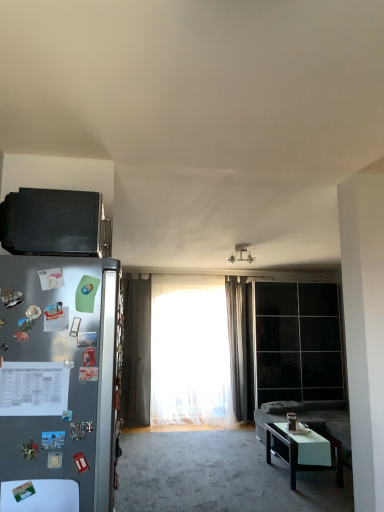
What do you see at coordinates (190, 351) in the screenshot? I see `white sheer curtain at center, positioned as the first curtain in left-to-right order` at bounding box center [190, 351].

Measure the distance between point (26,453) and camera.

Point (26,453) and camera are 1.69 meters apart.

The width and height of the screenshot is (384, 512). I want to click on black glossy coffee table at lower right, so click(x=304, y=450).

What is the approximate width of black glossy coffee table at lower right?

It is 23.58 inches.

What is the approximate width of transparent glass door at center?

transparent glass door at center is 19.11 inches wide.

Where is `white sheer curtain at center, arranged as the second curtain when viewed from the right`? white sheer curtain at center, arranged as the second curtain when viewed from the right is located at coordinates (190, 351).

Are white glossy table at lower left and dark gray sheer curtain at center, arranged as the first curtain when viewed from the right, far apart?

Yes, white glossy table at lower left and dark gray sheer curtain at center, arranged as the first curtain when viewed from the right, are located far from each other.

Is white glossy table at lower left facing away from dark gray sheer curtain at center, which is the 2th curtain from left to right?

Yes, white glossy table at lower left is positioned with its back facing dark gray sheer curtain at center, which is the 2th curtain from left to right.

From a real-world perspective, between white glossy table at lower left and dark gray sheer curtain at center, which is the 2th curtain from left to right, who is vertically higher?

dark gray sheer curtain at center, which is the 2th curtain from left to right.

Can you confirm if white glossy table at lower left is positioned to the left of dark gray sheer curtain at center, arranged as the first curtain when viewed from the right?

Indeed, white glossy table at lower left is positioned on the left side of dark gray sheer curtain at center, arranged as the first curtain when viewed from the right.

Can you confirm if dark gray sheer curtain at center, arranged as the first curtain when viewed from the right, is positioned to the right of transparent glass door at center?

In fact, dark gray sheer curtain at center, arranged as the first curtain when viewed from the right, is to the left of transparent glass door at center.

Which object is wider, dark gray sheer curtain at center, arranged as the first curtain when viewed from the right, or transparent glass door at center?

transparent glass door at center is wider.

In the image, is dark gray sheer curtain at center, arranged as the first curtain when viewed from the right, positioned in front of or behind transparent glass door at center?

Clearly, dark gray sheer curtain at center, arranged as the first curtain when viewed from the right, is behind transparent glass door at center.

Is there a large distance between dark gray sheer curtain at center, which is the 2th curtain from left to right, and transparent glass door at center?

They are positioned close to each other.

Does white sheer curtain at center, positioned as the first curtain in left-to-right order, have a smaller size compared to black matte microwave at upper left?

No.

Is the surface of white sheer curtain at center, arranged as the second curtain when viewed from the right, in direct contact with black matte microwave at upper left?

No, white sheer curtain at center, arranged as the second curtain when viewed from the right, is not with black matte microwave at upper left.

Could you tell me if white sheer curtain at center, arranged as the second curtain when viewed from the right, is facing black matte microwave at upper left?

Yes, white sheer curtain at center, arranged as the second curtain when viewed from the right, faces towards black matte microwave at upper left.

Is white sheer curtain at center, arranged as the second curtain when viewed from the right, positioned before black matte microwave at upper left?

No, white sheer curtain at center, arranged as the second curtain when viewed from the right, is behind black matte microwave at upper left.

Which of these two, black matte microwave at upper left or satin silver refrigerator at left, stands taller?

satin silver refrigerator at left is taller.

How far apart are black matte microwave at upper left and satin silver refrigerator at left?

black matte microwave at upper left is 15.02 inches away from satin silver refrigerator at left.

From the image's perspective, which object appears higher, black matte microwave at upper left or satin silver refrigerator at left?

From the image's view, black matte microwave at upper left is above.

Between black matte microwave at upper left and satin silver refrigerator at left, which one has smaller width?

black matte microwave at upper left is thinner.

Is satin silver refrigerator at left positioned far away from transparent glass door at center?

Yes, satin silver refrigerator at left and transparent glass door at center are located far from each other.

From the image's perspective, is satin silver refrigerator at left beneath transparent glass door at center?

Actually, satin silver refrigerator at left appears above transparent glass door at center in the image.

This screenshot has width=384, height=512. I want to click on glass door below the satin silver refrigerator at left (from the image's perspective), so click(x=298, y=342).

From a real-world perspective, is satin silver refrigerator at left on transparent glass door at center?

Indeed, from a real-world perspective, satin silver refrigerator at left stands above transparent glass door at center.

Considering the relative sizes of dark gray sheer curtain at center, which is the 2th curtain from left to right, and black glossy coffee table at lower right in the image provided, is dark gray sheer curtain at center, which is the 2th curtain from left to right, taller than black glossy coffee table at lower right?

Correct, dark gray sheer curtain at center, which is the 2th curtain from left to right, is much taller as black glossy coffee table at lower right.

Is dark gray sheer curtain at center, arranged as the first curtain when viewed from the right, to the right of black glossy coffee table at lower right from the viewer's perspective?

No, dark gray sheer curtain at center, arranged as the first curtain when viewed from the right, is not to the right of black glossy coffee table at lower right.

Can you confirm if dark gray sheer curtain at center, which is the 2th curtain from left to right, is smaller than black glossy coffee table at lower right?

Yes.

Based on the photo, can you confirm if dark gray sheer curtain at center, arranged as the first curtain when viewed from the right, is wider than black glossy coffee table at lower right?

No, dark gray sheer curtain at center, arranged as the first curtain when viewed from the right, is not wider than black glossy coffee table at lower right.

Is dark gray sheer curtain at center, which is the 2th curtain from left to right, not near white glossy table at lower left?

Indeed, dark gray sheer curtain at center, which is the 2th curtain from left to right, is not near white glossy table at lower left.

Considering the relative sizes of dark gray sheer curtain at center, arranged as the first curtain when viewed from the right, and white glossy table at lower left in the image provided, is dark gray sheer curtain at center, arranged as the first curtain when viewed from the right, thinner than white glossy table at lower left?

No.

The image size is (384, 512). Find the location of `curtain that is the 2nd object located behind the white glossy table at lower left`. curtain that is the 2nd object located behind the white glossy table at lower left is located at coordinates (237, 343).

Which object is closer to the camera taking this photo, dark gray sheer curtain at center, arranged as the first curtain when viewed from the right, or white glossy table at lower left?

Positioned in front is white glossy table at lower left.

Where is `table lying on the left of dark gray sheer curtain at center, which is the 2th curtain from left to right`? table lying on the left of dark gray sheer curtain at center, which is the 2th curtain from left to right is located at coordinates (40, 495).

Where is `glass door below the dark gray sheer curtain at center, arranged as the first curtain when viewed from the right (from the image's perspective)`? The image size is (384, 512). glass door below the dark gray sheer curtain at center, arranged as the first curtain when viewed from the right (from the image's perspective) is located at coordinates (298, 342).

Based on their spatial positions, is white sheer curtain at center, arranged as the second curtain when viewed from the right, or black matte microwave at upper left further from transparent glass door at center?

Among the two, black matte microwave at upper left is located further to transparent glass door at center.

Which object lies nearer to the anchor point dark gray sheer curtain at center, which is the 2th curtain from left to right, black matte microwave at upper left or white glossy table at lower left?

black matte microwave at upper left lies closer to dark gray sheer curtain at center, which is the 2th curtain from left to right, than the other object.

Looking at the image, which one is located further to transparent glass door at center, satin silver refrigerator at left or white glossy table at lower left?

white glossy table at lower left.

Which object lies further to the anchor point satin silver refrigerator at left, transparent glass door at center or white sheer curtain at center, arranged as the second curtain when viewed from the right?

transparent glass door at center is further to satin silver refrigerator at left.

Considering their positions, is satin silver refrigerator at left positioned closer to dark gray sheer curtain at center, which is the 2th curtain from left to right, than black glossy coffee table at lower right?

black glossy coffee table at lower right.

When comparing their distances from satin silver refrigerator at left, does black matte microwave at upper left or dark gray sheer curtain at center, which is the 2th curtain from left to right, seem further?

The object further to satin silver refrigerator at left is dark gray sheer curtain at center, which is the 2th curtain from left to right.

From the image, which object appears to be farther from satin silver refrigerator at left, black glossy coffee table at lower right or black matte microwave at upper left?

The object further to satin silver refrigerator at left is black glossy coffee table at lower right.

When comparing their distances from white sheer curtain at center, arranged as the second curtain when viewed from the right, does black matte microwave at upper left or satin silver refrigerator at left seem further?

satin silver refrigerator at left is positioned further to the anchor white sheer curtain at center, arranged as the second curtain when viewed from the right.

The height and width of the screenshot is (512, 384). I want to click on appliance between white glossy table at lower left and white sheer curtain at center, arranged as the second curtain when viewed from the right, along the z-axis, so click(x=55, y=223).

Identify the location of table located between satin silver refrigerator at left and dark gray sheer curtain at center, arranged as the first curtain when viewed from the right, in the depth direction. The width and height of the screenshot is (384, 512). (40, 495).

Where is `glass door located between satin silver refrigerator at left and dark gray sheer curtain at center, arranged as the first curtain when viewed from the right, in the depth direction`? This screenshot has width=384, height=512. glass door located between satin silver refrigerator at left and dark gray sheer curtain at center, arranged as the first curtain when viewed from the right, in the depth direction is located at coordinates (298, 342).

Locate an element on the screen. curtain between white sheer curtain at center, positioned as the first curtain in left-to-right order, and transparent glass door at center, in the horizontal direction is located at coordinates click(x=237, y=343).